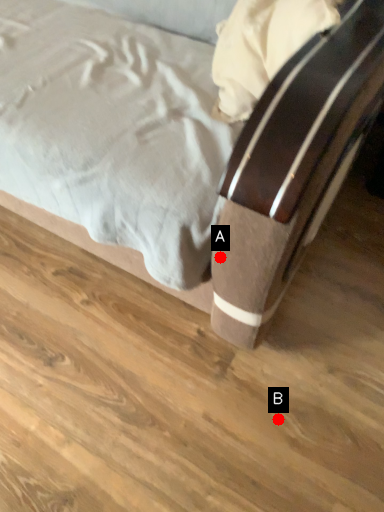
Question: Two points are circled on the image, labeled by A and B beside each circle. Which of the following is the farthest from the observer?

Choices:
 (A) A is further
 (B) B is further

Answer: (B)